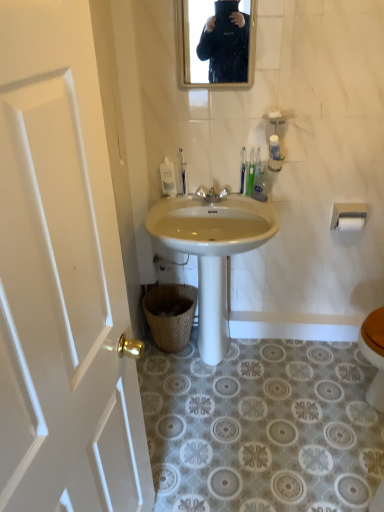
This screenshot has width=384, height=512. In order to click on vacant space that is to the left of white plastic toothbrush at upper center, which ranks as the 2th toilet brush in left-to-right order in this screenshot , I will do `click(211, 200)`.